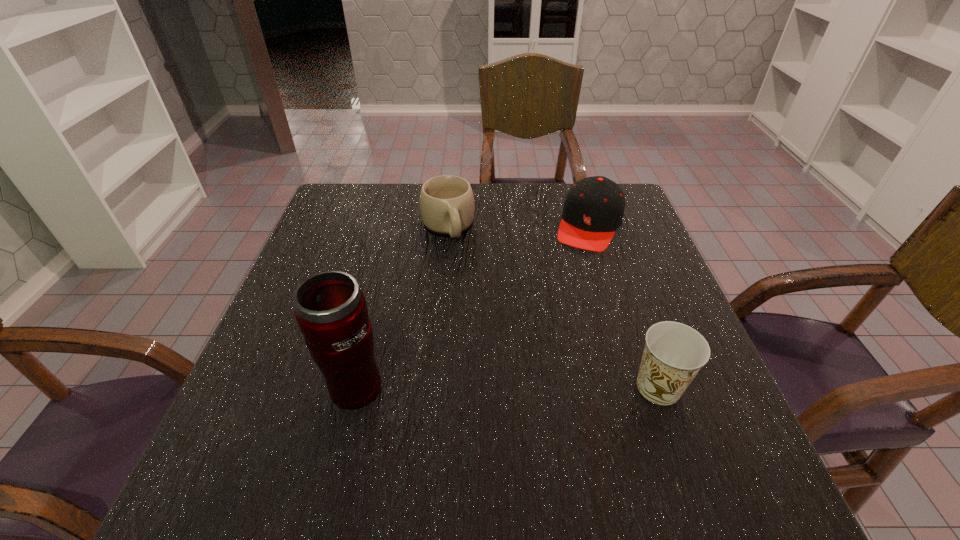
Image resolution: width=960 pixels, height=540 pixels. What are the coordinates of `vacant space located on the front-facing side of the cap` in the screenshot? It's located at (550, 329).

Locate an element on the screen. vacant space located on the front-facing side of the cap is located at coordinates (540, 353).

Where is `vacant area situated on the front-facing side of the cap`? Image resolution: width=960 pixels, height=540 pixels. vacant area situated on the front-facing side of the cap is located at coordinates (573, 275).

Find the location of `mug present at the far edge`. mug present at the far edge is located at coordinates (447, 205).

Where is `cap located at the far edge`? The height and width of the screenshot is (540, 960). cap located at the far edge is located at coordinates (593, 210).

The width and height of the screenshot is (960, 540). I want to click on thermos bottle that is at the near edge, so click(x=331, y=311).

I want to click on Dixie cup positioned at the near edge, so click(674, 353).

You are a GUI agent. You are given a task and a screenshot of the screen. Output one action in this format:
    pyautogui.click(x=<x>, y=<y>)
    Task: Click on the object present at the left edge
    The width and height of the screenshot is (960, 540).
    Given the screenshot: What is the action you would take?
    pyautogui.click(x=331, y=311)

You are a GUI agent. You are given a task and a screenshot of the screen. Output one action in this format:
    pyautogui.click(x=<x>, y=<y>)
    Task: Click on the Dixie cup that is at the right edge
    This screenshot has height=540, width=960.
    Given the screenshot: What is the action you would take?
    pyautogui.click(x=674, y=353)

Where is `cap that is at the right edge`? The height and width of the screenshot is (540, 960). cap that is at the right edge is located at coordinates (593, 210).